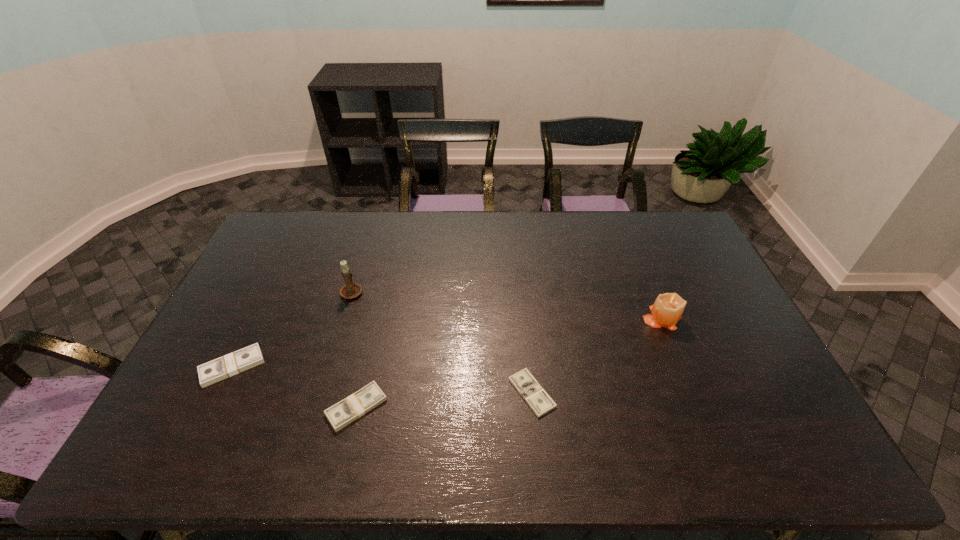
Where is `vacant space that is in between the tallest object and the rightmost object`? vacant space that is in between the tallest object and the rightmost object is located at coordinates (507, 304).

Where is `free space between the second dollar from left to right and the leftmost dollar`? This screenshot has height=540, width=960. free space between the second dollar from left to right and the leftmost dollar is located at coordinates (295, 387).

Select which object appears as the second closest to the tallest object. Please provide its 2D coordinates. Your answer should be formatted as a tuple, i.e. [(x, y)], where the tuple contains the x and y coordinates of a point satisfying the conditions above.

[(343, 413)]

Locate an element on the screen. This screenshot has width=960, height=540. object that is the fourth closest to the leftmost dollar is located at coordinates (667, 310).

Find the location of a particular element. The image size is (960, 540). dollar that is the closest to the rightmost object is located at coordinates (539, 401).

Identify which dollar is located as the nearest to the shortest object. Please provide its 2D coordinates. Your answer should be formatted as a tuple, i.e. [(x, y)], where the tuple contains the x and y coordinates of a point satisfying the conditions above.

[(343, 413)]

In order to click on vacant space that satisfies the following two spatial constraints: 1. on the back side of the fourth object from left to right; 2. on the left side of the rightmost object in this screenshot , I will do `click(524, 318)`.

You are a GUI agent. You are given a task and a screenshot of the screen. Output one action in this format:
    pyautogui.click(x=<x>, y=<y>)
    Task: Click on the vacant space that satisfies the following two spatial constraints: 1. on the front side of the leftmost dollar; 2. on the left side of the second dollar from left to right
    The height and width of the screenshot is (540, 960).
    Given the screenshot: What is the action you would take?
    pyautogui.click(x=212, y=407)

I want to click on free space that satisfies the following two spatial constraints: 1. on the front side of the leftmost dollar; 2. on the left side of the fourth object from left to right, so click(219, 393).

Locate an element on the screen. free location that satisfies the following two spatial constraints: 1. on the back side of the second dollar from left to right; 2. on the right side of the shortest dollar is located at coordinates (360, 393).